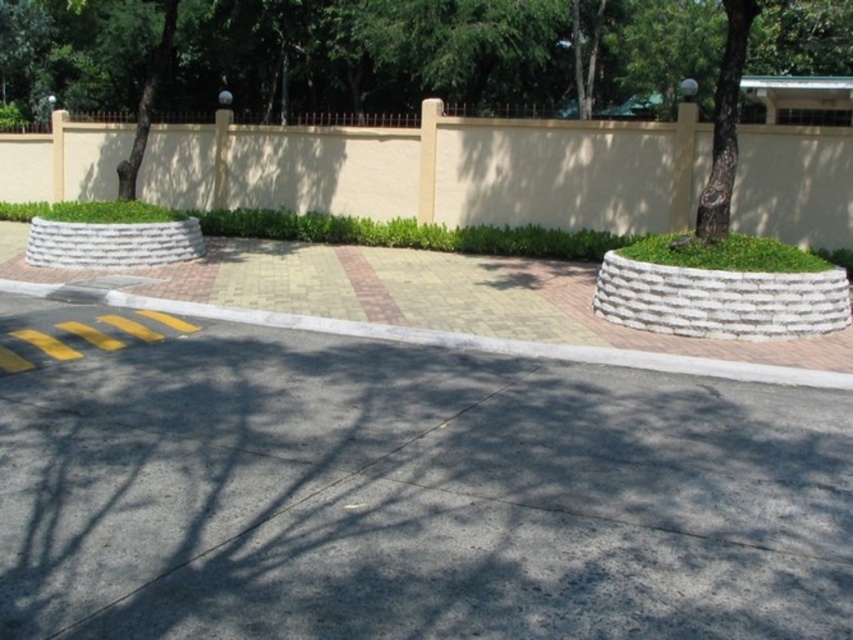
Question: Estimate the real-world distances between objects in this image. Which object is closer to the gray asphalt pavement at center?

Choices:
 (A) yellow brick curb at center
 (B) beige concrete wall at upper center

Answer: (A)

Question: Which point is farther to the camera?

Choices:
 (A) (326, 176)
 (B) (817, 372)

Answer: (A)

Question: Does gray asphalt pavement at center have a larger size compared to beige concrete wall at upper center?

Choices:
 (A) no
 (B) yes

Answer: (A)

Question: Which object is closer to the camera taking this photo?

Choices:
 (A) yellow brick curb at center
 (B) beige concrete wall at upper center
 (C) gray asphalt pavement at center

Answer: (C)

Question: Can you confirm if gray asphalt pavement at center is smaller than yellow brick curb at center?

Choices:
 (A) no
 (B) yes

Answer: (B)

Question: Does beige concrete wall at upper center lie behind yellow brick curb at center?

Choices:
 (A) yes
 (B) no

Answer: (A)